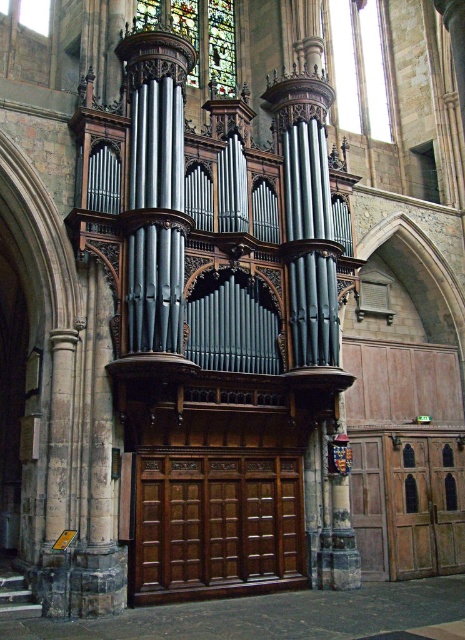
Does clear glass at upper center have a greater width compared to stained glass at upper center?

Incorrect, clear glass at upper center's width does not surpass stained glass at upper center's.

How far apart are clear glass at upper center and stained glass at upper center?

The distance of clear glass at upper center from stained glass at upper center is 47.25 feet.

Does point (357, 124) come closer to viewer compared to point (214, 0)?

No, it is behind (214, 0).

The image size is (465, 640). What are the coordinates of `clear glass at upper center` in the screenshot? It's located at (359, 68).